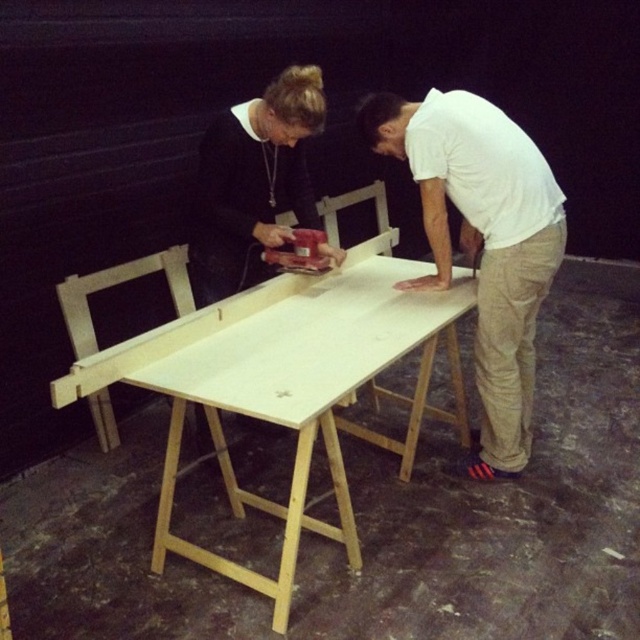
Based on the photo, you are a tailor observing two shirts in a workshop scene. The shirts are labeled as the white cotton shirt at center and the white matte shirt at upper center. Which shirt is positioned higher up in the image?

The white matte shirt at upper center is positioned higher up in the image compared to the white cotton shirt at center.

You are standing in the workshop and see the white matte wood table at center and the white matte shirt at upper center. Which object is closer to the floor?

The white matte wood table at center is closer to the floor because it is positioned under the white matte shirt at upper center.

You are a carpenter trying to place a 15 cm tall tool on the white matte wood table at center. The tool requires at least 10 cm of vertical space to be placed safely. Can you confirm if the white cotton shirt at center is blocking the space above the table?

The white matte wood table at center has a lesser height compared to white cotton shirt at center, meaning the shirt is taller. Since the shirt is taller than the table, it might be blocking the vertical space above the table. Therefore, the 15 cm tall tool may not have enough vertical space to be placed safely.